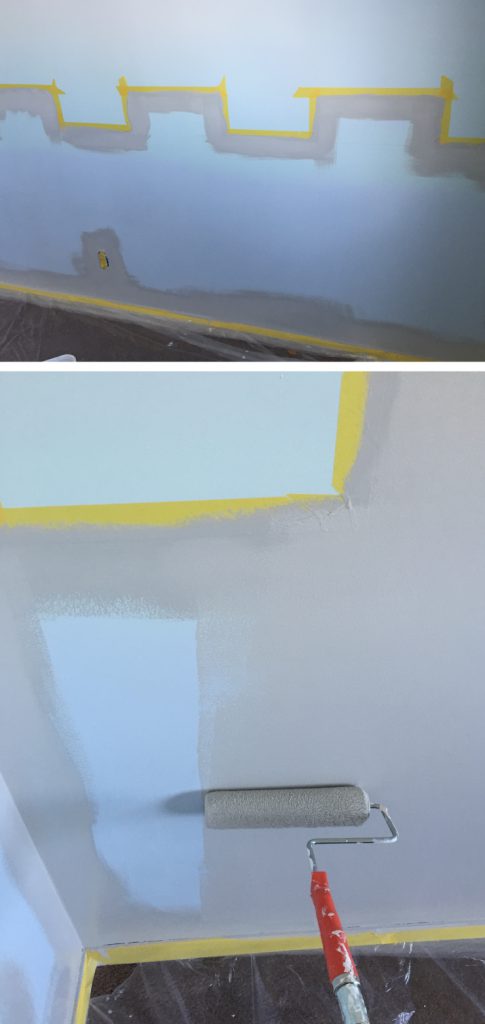
Locate an element on the screen. The height and width of the screenshot is (1024, 485). paint splashes on plastic floor covering is located at coordinates (110, 1011), (130, 1016), (232, 1016), (405, 1017), (171, 341), (209, 332), (245, 354).